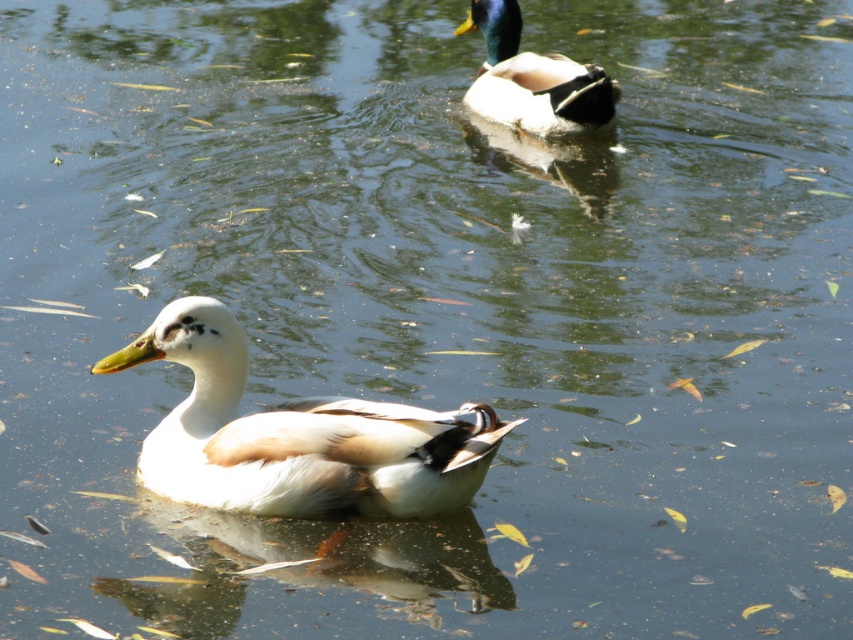
Which is more to the right, white matte duck at center or shiny green and brown duck at upper center?

From the viewer's perspective, shiny green and brown duck at upper center appears more on the right side.

Is point (466, 496) behind point (532, 90)?

No, (466, 496) is closer to viewer.

Is point (207, 410) farther from camera compared to point (515, 20)?

No, (207, 410) is in front of (515, 20).

Where is `white matte duck at center`? The width and height of the screenshot is (853, 640). white matte duck at center is located at coordinates (296, 435).